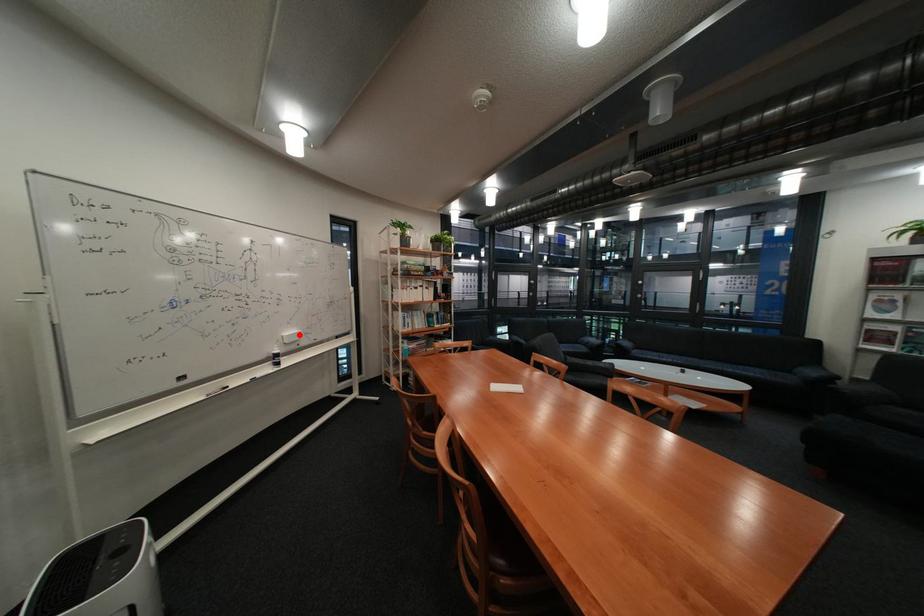
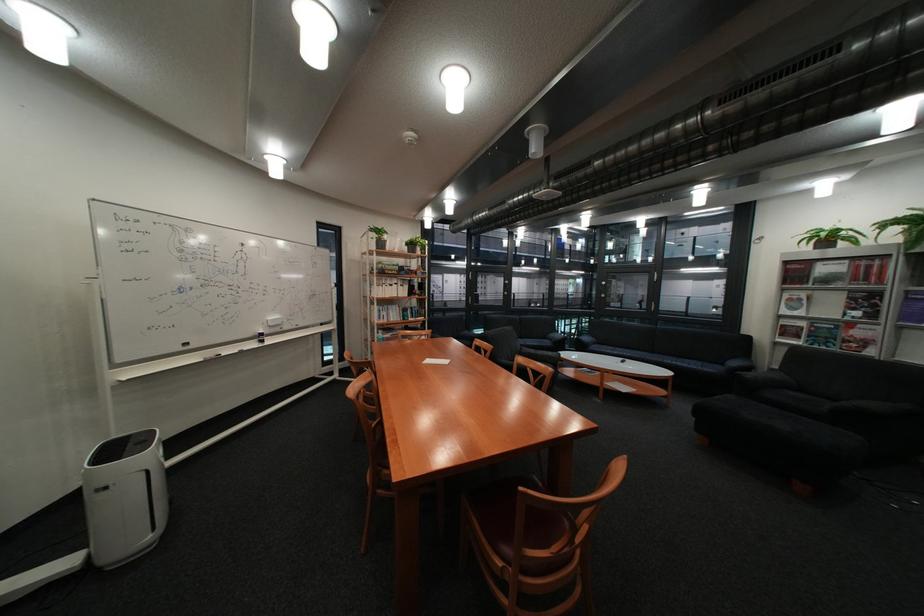
In the second image, find the point that corresponds to the highlighted location in the first image.

(284, 318)